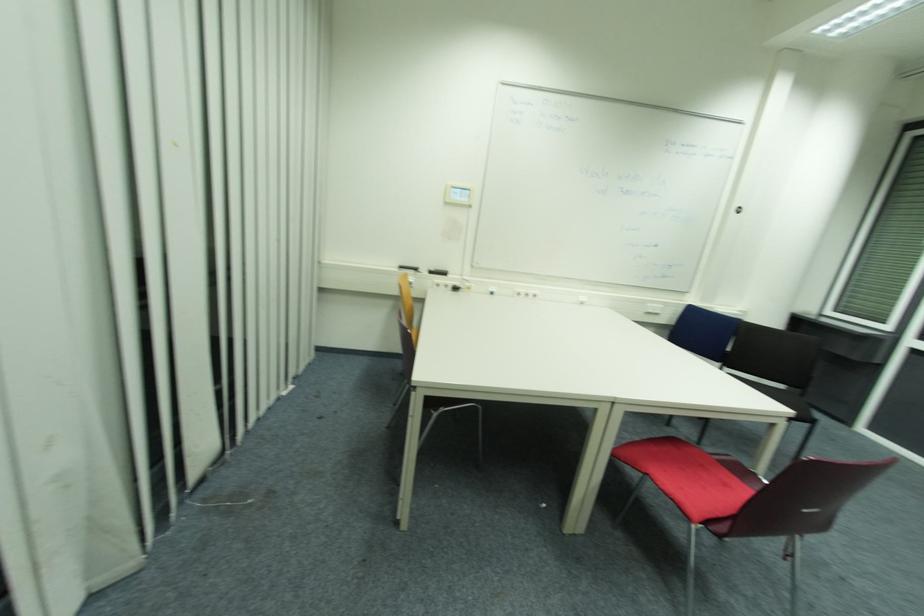
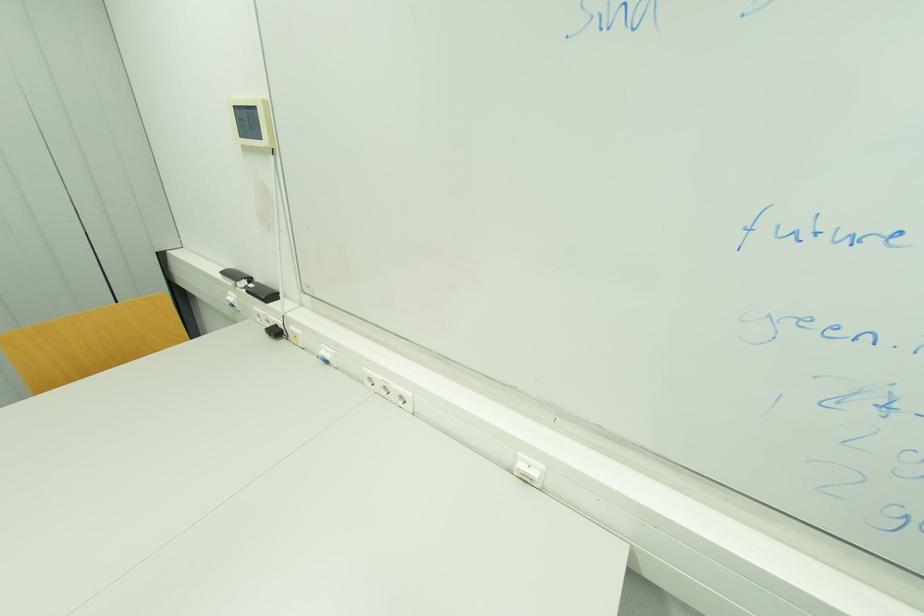
Where in the second image is the point corresponding to point (458, 290) from the first image?

(281, 333)